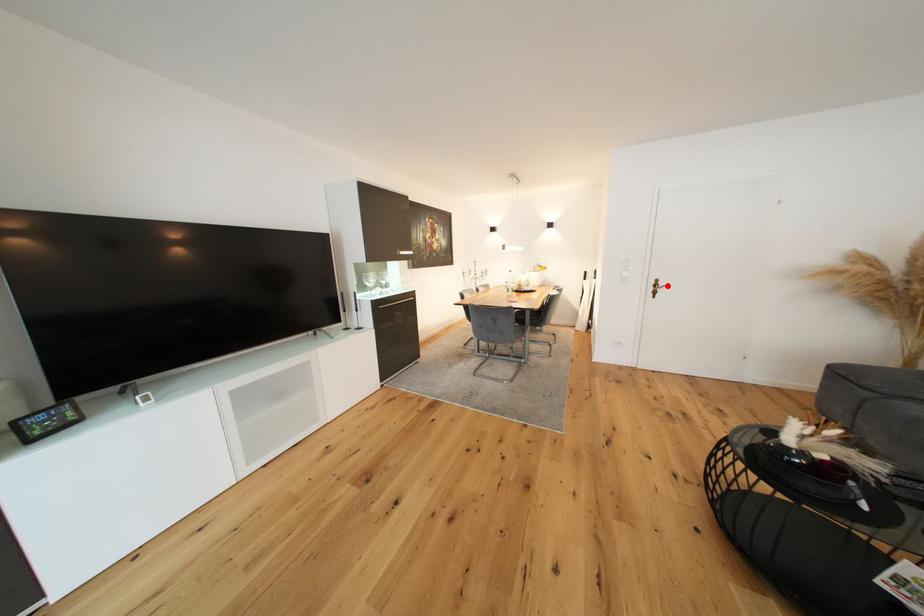
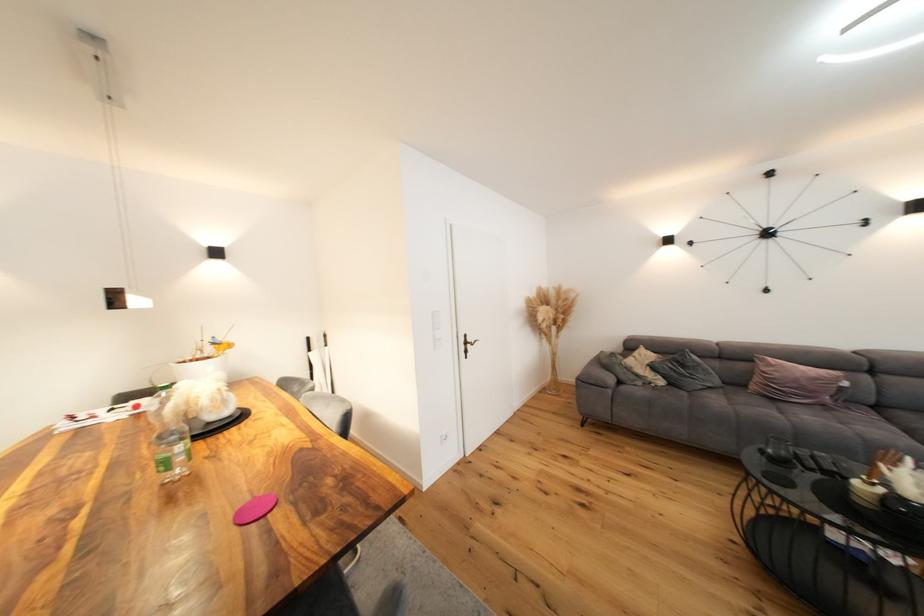
The point at the highlighted location is marked in the first image. Where is the corresponding point in the second image?

(476, 341)